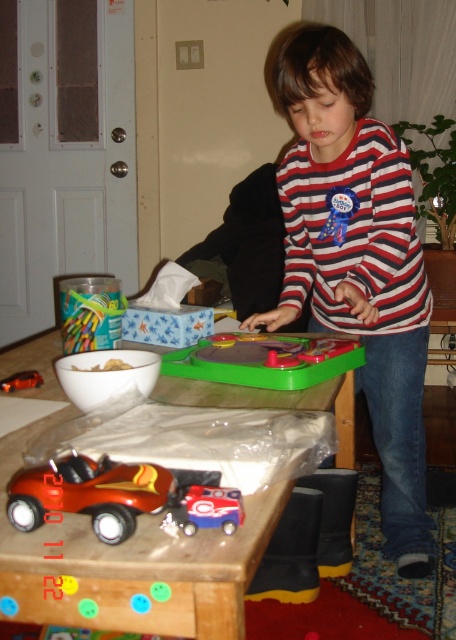
Question: Among these objects, which one is farthest from the camera?

Choices:
 (A) metallic red car at lower left
 (B) metallic red toy car at lower left

Answer: (A)

Question: Where is wooden table at center located in relation to blue plastic toy car at center in the image?

Choices:
 (A) left
 (B) right

Answer: (A)

Question: Can you confirm if striped cotton shirt at center is positioned to the left of metallic red car at lower left?

Choices:
 (A) yes
 (B) no

Answer: (B)

Question: Considering the real-world distances, which object is closest to the wooden table at center?

Choices:
 (A) blue plastic toy car at center
 (B) striped cotton shirt at center

Answer: (A)

Question: Does striped cotton shirt at center appear on the left side of metallic red toy car at lower left?

Choices:
 (A) no
 (B) yes

Answer: (A)

Question: Estimate the real-world distances between objects in this image. Which object is closer to the striped cotton shirt at center?

Choices:
 (A) green plastic playset at center
 (B) blue plastic toy car at center
 (C) wooden table at center
 (D) metallic red toy car at lower left

Answer: (A)